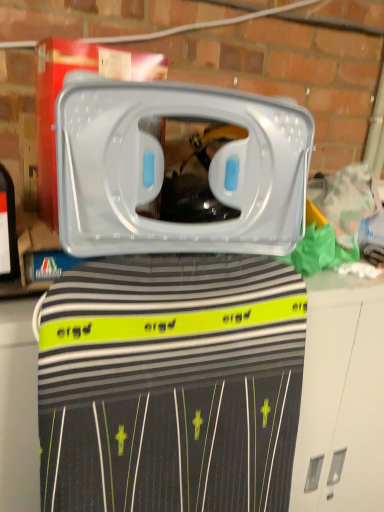
Question: Is transparent plastic container at center to the left or to the right of black striped fabric at center in the image?

Choices:
 (A) right
 (B) left

Answer: (B)

Question: Is transparent plastic container at center taller or shorter than black striped fabric at center?

Choices:
 (A) short
 (B) tall

Answer: (A)

Question: From the image's perspective, is transparent plastic container at center positioned above or below black striped fabric at center?

Choices:
 (A) below
 (B) above

Answer: (B)

Question: Is black striped fabric at center to the left or to the right of transparent plastic container at center in the image?

Choices:
 (A) left
 (B) right

Answer: (B)

Question: Considering the positions of point (251, 320) and point (147, 109), is point (251, 320) closer or farther from the camera than point (147, 109)?

Choices:
 (A) farther
 (B) closer

Answer: (A)

Question: In terms of width, does black striped fabric at center look wider or thinner when compared to transparent plastic container at center?

Choices:
 (A) thin
 (B) wide

Answer: (B)

Question: Is black striped fabric at center taller or shorter than transparent plastic container at center?

Choices:
 (A) tall
 (B) short

Answer: (A)